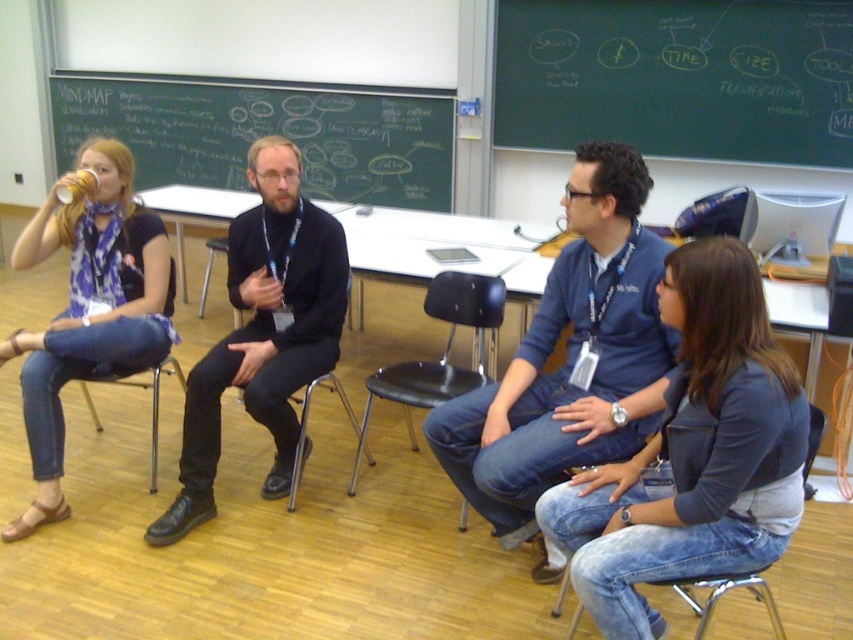
Is black matte jacket at center to the left of metallic silver chair at center from the viewer's perspective?

Yes, black matte jacket at center is to the left of metallic silver chair at center.

Can you confirm if black matte jacket at center is smaller than metallic silver chair at center?

Actually, black matte jacket at center might be larger than metallic silver chair at center.

Identify the location of black matte jacket at center. Image resolution: width=853 pixels, height=640 pixels. (263, 332).

Image resolution: width=853 pixels, height=640 pixels. I want to click on black matte jacket at center, so click(263, 332).

Is point (450, 346) closer to camera compared to point (338, 380)?

No, (450, 346) is behind (338, 380).

Is black leather chair at center behind metallic silver chair at center?

That is False.

Who is more distant from viewer, (500, 282) or (349, 307)?

Point (349, 307)

Locate an element on the screen. The height and width of the screenshot is (640, 853). black leather chair at center is located at coordinates (442, 353).

Is point (595, 227) closer to camera compared to point (281, 413)?

Yes, point (595, 227) is closer to viewer.

In order to click on blue denim jeans at center in this screenshot , I will do `click(570, 356)`.